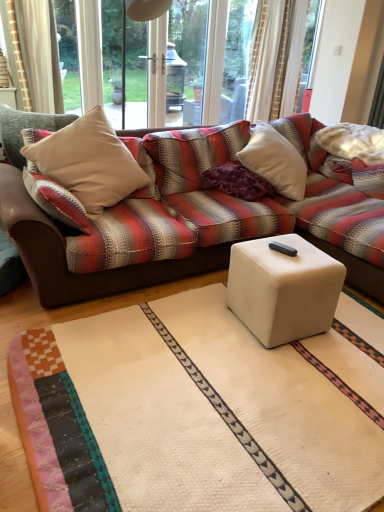
This screenshot has width=384, height=512. I want to click on free space above white matte cube at center (from a real-world perspective), so click(289, 252).